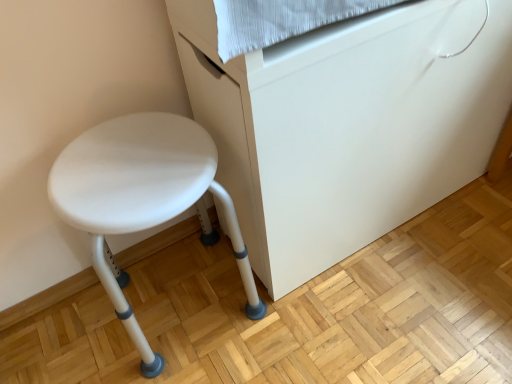
Question: Considering the relative sizes of white plastic stool at left and white plastic stool at lower left in the image provided, is white plastic stool at left taller than white plastic stool at lower left?

Choices:
 (A) yes
 (B) no

Answer: (B)

Question: From the image's perspective, is white plastic stool at left located beneath white plastic stool at lower left?

Choices:
 (A) no
 (B) yes

Answer: (B)

Question: Is white plastic stool at left positioned before white plastic stool at lower left?

Choices:
 (A) yes
 (B) no

Answer: (B)

Question: Is white plastic stool at left further to camera compared to white plastic stool at lower left?

Choices:
 (A) yes
 (B) no

Answer: (A)

Question: From a real-world perspective, is white plastic stool at left located higher than white plastic stool at lower left?

Choices:
 (A) no
 (B) yes

Answer: (A)

Question: Is white plastic stool at left turned away from white plastic stool at lower left?

Choices:
 (A) yes
 (B) no

Answer: (B)

Question: Could you tell me if white plastic stool at lower left is turned towards white plastic stool at left?

Choices:
 (A) no
 (B) yes

Answer: (A)

Question: Does white plastic stool at lower left come behind white plastic stool at left?

Choices:
 (A) no
 (B) yes

Answer: (A)

Question: Is white plastic stool at lower left positioned beyond the bounds of white plastic stool at left?

Choices:
 (A) no
 (B) yes

Answer: (B)

Question: Considering the relative positions of white plastic stool at lower left and white plastic stool at left in the image provided, is white plastic stool at lower left to the right of white plastic stool at left from the viewer's perspective?

Choices:
 (A) no
 (B) yes

Answer: (B)

Question: Can you confirm if white plastic stool at lower left is smaller than white plastic stool at left?

Choices:
 (A) yes
 (B) no

Answer: (B)

Question: Considering the relative sizes of white plastic stool at lower left and white plastic stool at left in the image provided, is white plastic stool at lower left thinner than white plastic stool at left?

Choices:
 (A) yes
 (B) no

Answer: (A)

Question: From a real-world perspective, is white plastic stool at lower left above or below white plastic stool at left?

Choices:
 (A) below
 (B) above

Answer: (B)